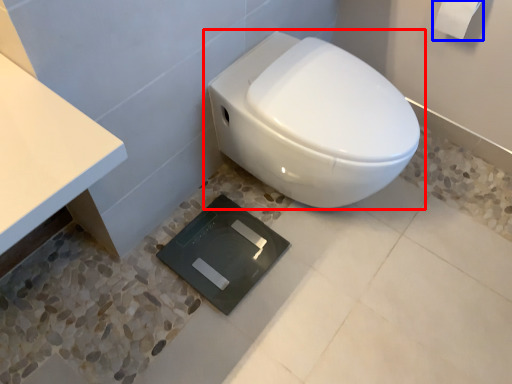
Question: Among these objects, which one is farthest to the camera, toilet (highlighted by a red box) or toilet paper (highlighted by a blue box)?

Choices:
 (A) toilet
 (B) toilet paper

Answer: (B)